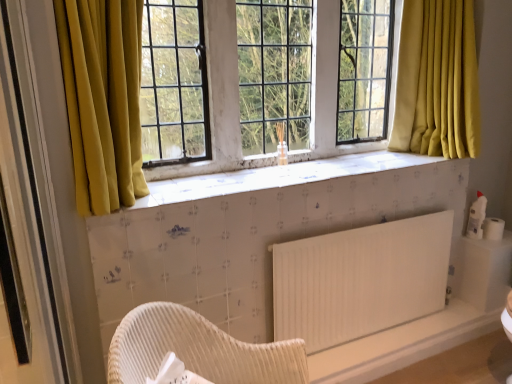
Question: From the image's perspective, is white matte radiator at lower right below white textured tile at center?

Choices:
 (A) yes
 (B) no

Answer: (A)

Question: Is white matte radiator at lower right not close to white textured tile at center?

Choices:
 (A) yes
 (B) no

Answer: (B)

Question: Does white matte radiator at lower right turn towards white textured tile at center?

Choices:
 (A) no
 (B) yes

Answer: (A)

Question: Are white matte radiator at lower right and white textured tile at center making contact?

Choices:
 (A) no
 (B) yes

Answer: (A)

Question: Is white matte radiator at lower right facing away from white textured tile at center?

Choices:
 (A) yes
 (B) no

Answer: (B)

Question: Is white matte radiator at lower right surrounding white textured tile at center?

Choices:
 (A) yes
 (B) no

Answer: (B)

Question: From the image's perspective, is white textured tile at center over woven wood chair at lower center?

Choices:
 (A) yes
 (B) no

Answer: (A)

Question: Does white textured tile at center have a larger size compared to woven wood chair at lower center?

Choices:
 (A) yes
 (B) no

Answer: (B)

Question: Is white textured tile at center directly adjacent to woven wood chair at lower center?

Choices:
 (A) yes
 (B) no

Answer: (B)

Question: From a real-world perspective, is white textured tile at center positioned over woven wood chair at lower center based on gravity?

Choices:
 (A) yes
 (B) no

Answer: (A)

Question: Is white textured tile at center located outside woven wood chair at lower center?

Choices:
 (A) yes
 (B) no

Answer: (A)

Question: Is white textured tile at center positioned in front of woven wood chair at lower center?

Choices:
 (A) no
 (B) yes

Answer: (A)

Question: From a real-world perspective, does white matte toilet paper at right sit lower than white matte radiator at lower right?

Choices:
 (A) no
 (B) yes

Answer: (A)